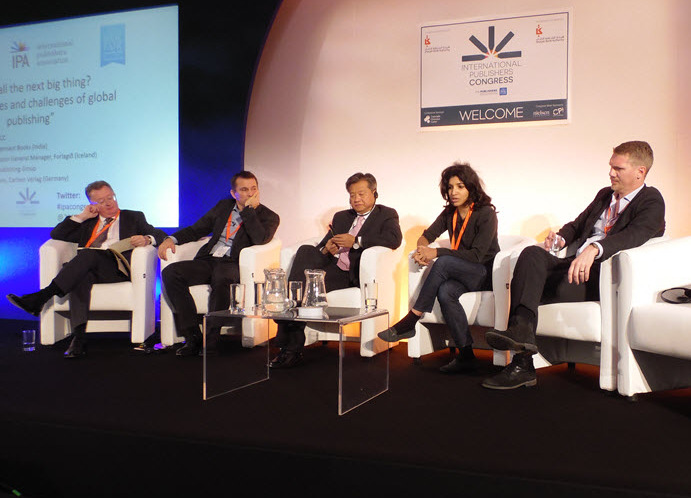
Locate an element on the screen. white chair is located at coordinates [x=95, y=296], [x=253, y=267], [x=374, y=259], [x=497, y=269], [x=598, y=302], [x=650, y=313].